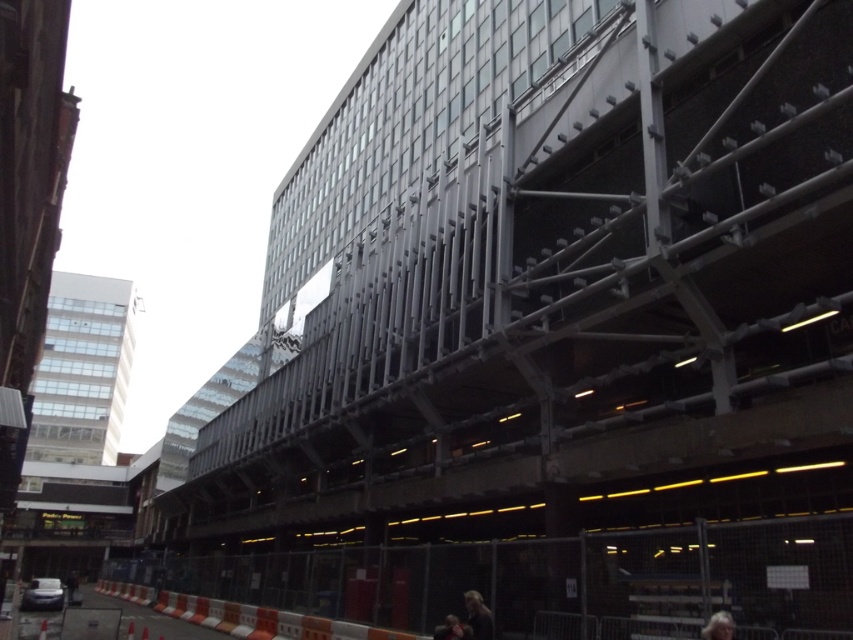
Question: Is orange and white striped barrier at lower center positioned at the back of light brown hair at lower center?

Choices:
 (A) no
 (B) yes

Answer: (B)

Question: Does orange and white striped barrier at lower center have a lesser width compared to gray hair at lower right?

Choices:
 (A) yes
 (B) no

Answer: (B)

Question: Which of these objects is positioned closest to the light brown hair at lower center?

Choices:
 (A) orange and white striped barrier at lower center
 (B) dark hair at lower center

Answer: (B)

Question: Which object is farther from the camera taking this photo?

Choices:
 (A) orange and white striped barrier at lower center
 (B) gray hair at lower right
 (C) dark hair at lower center

Answer: (A)

Question: Is light brown hair at lower center below gray hair at lower right?

Choices:
 (A) yes
 (B) no

Answer: (A)

Question: Which point is farther to the camera?

Choices:
 (A) dark hair at lower center
 (B) orange and white striped barrier at lower center

Answer: (B)